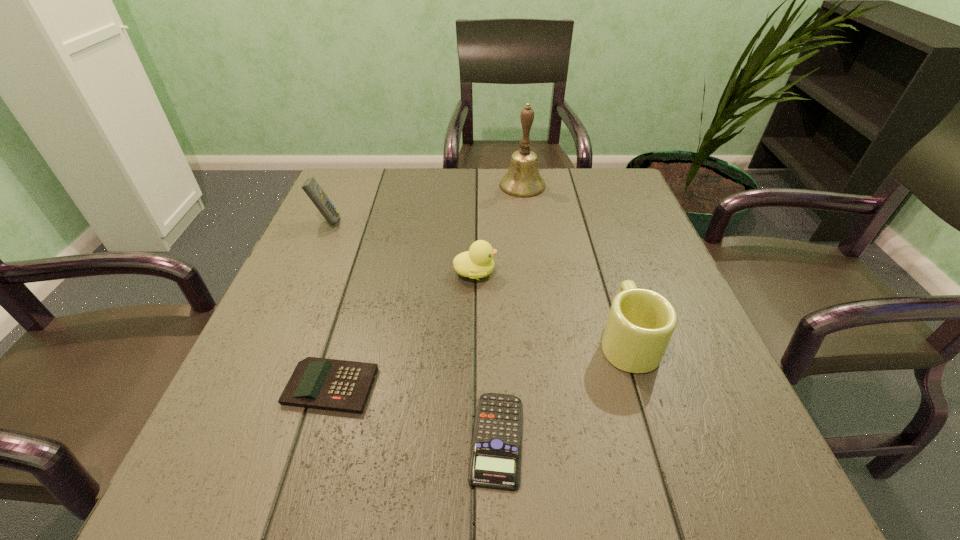
This screenshot has height=540, width=960. In order to click on the third closest object to the rightmost object in this screenshot , I will do `click(328, 384)`.

Select which object appears as the second closest to the duckling. Please provide its 2D coordinates. Your answer should be formatted as a tuple, i.e. [(x, y)], where the tuple contains the x and y coordinates of a point satisfying the conditions above.

[(328, 384)]

You are a GUI agent. You are given a task and a screenshot of the screen. Output one action in this format:
    pyautogui.click(x=<x>, y=<y>)
    Task: Click on the second closest calculator to the shortest object
    
    Given the screenshot: What is the action you would take?
    pyautogui.click(x=311, y=187)

Locate which calculator ranks second in proximity to the rightmost calculator. Please provide its 2D coordinates. Your answer should be formatted as a tuple, i.e. [(x, y)], where the tuple contains the x and y coordinates of a point satisfying the conditions above.

[(311, 187)]

At what (x,y) coordinates should I click in order to perform the action: click on free location that satisfies the following two spatial constraints: 1. at the beak of the fourth tallest object; 2. with the handle on the side of the mug. Please return your answer as a coordinate pair (x, y). Looking at the image, I should click on (474, 341).

At what (x,y) coordinates should I click in order to perform the action: click on free space that satisfies the following two spatial constraints: 1. on the front-facing side of the shortest object; 2. on the left side of the tallest calculator. Please return your answer as a coordinate pair (x, y). This screenshot has width=960, height=540. Looking at the image, I should click on coord(229,439).

I want to click on vacant space that satisfies the following two spatial constraints: 1. at the beak of the shortest calculator; 2. on the left side of the duckling, so click(473, 439).

You are a GUI agent. You are given a task and a screenshot of the screen. Output one action in this format:
    pyautogui.click(x=<x>, y=<y>)
    Task: Click on the free space in the image that satisfies the following two spatial constraints: 1. on the front side of the farthest object; 2. on the front-facing side of the farthest calculator
    The width and height of the screenshot is (960, 540).
    Given the screenshot: What is the action you would take?
    pyautogui.click(x=527, y=221)

Identify the location of vacant space that satisfies the following two spatial constraints: 1. at the beak of the third farthest object; 2. on the back side of the shortest calculator. The width and height of the screenshot is (960, 540). (473, 439).

You are a GUI agent. You are given a task and a screenshot of the screen. Output one action in this format:
    pyautogui.click(x=<x>, y=<y>)
    Task: Click on the blank space that satisfies the following two spatial constraints: 1. at the beak of the fourth tallest object; 2. with the handle on the side of the rightmost object
    
    Given the screenshot: What is the action you would take?
    pyautogui.click(x=474, y=341)